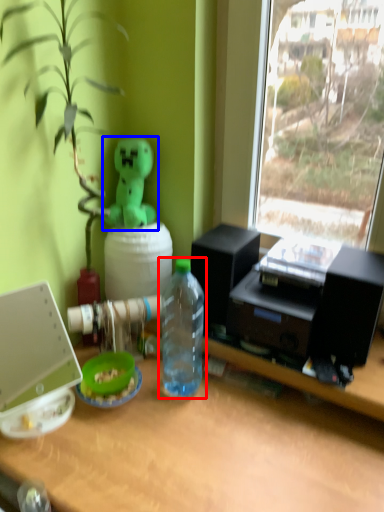
Question: Among these objects, which one is farthest to the camera, bottle (highlighted by a red box) or toy (highlighted by a blue box)?

Choices:
 (A) bottle
 (B) toy

Answer: (B)